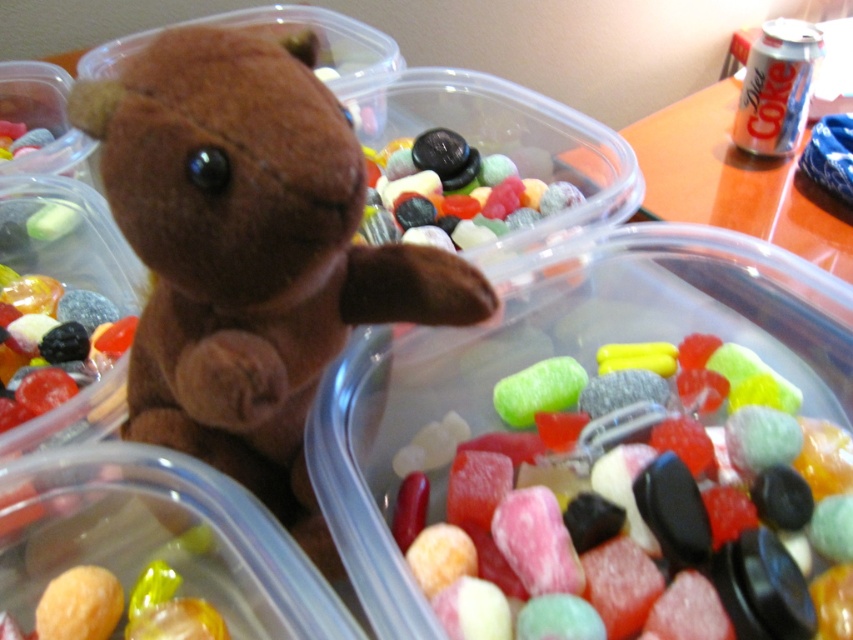
Who is positioned more to the right, brown plush toy at center or glossy black rock at center?

From the viewer's perspective, glossy black rock at center appears more on the right side.

The width and height of the screenshot is (853, 640). What do you see at coordinates (250, 253) in the screenshot? I see `brown plush toy at center` at bounding box center [250, 253].

Find the location of a particular element. This screenshot has height=640, width=853. brown plush toy at center is located at coordinates (250, 253).

Can you confirm if gummy candy at center is thinner than black rubber candy at center?

No.

Between gummy candy at center and black rubber candy at center, which one has more height?

Answer: gummy candy at center

Locate an element on the screen. Image resolution: width=853 pixels, height=640 pixels. gummy candy at center is located at coordinates (636, 513).

Is gummy candy at center shorter than glossy black rock at center?

In fact, gummy candy at center may be taller than glossy black rock at center.

Is gummy candy at center further to the viewer compared to glossy black rock at center?

No, it is not.

This screenshot has height=640, width=853. Describe the element at coordinates (636, 513) in the screenshot. I see `gummy candy at center` at that location.

Identify the location of gummy candy at center. The width and height of the screenshot is (853, 640). (636, 513).